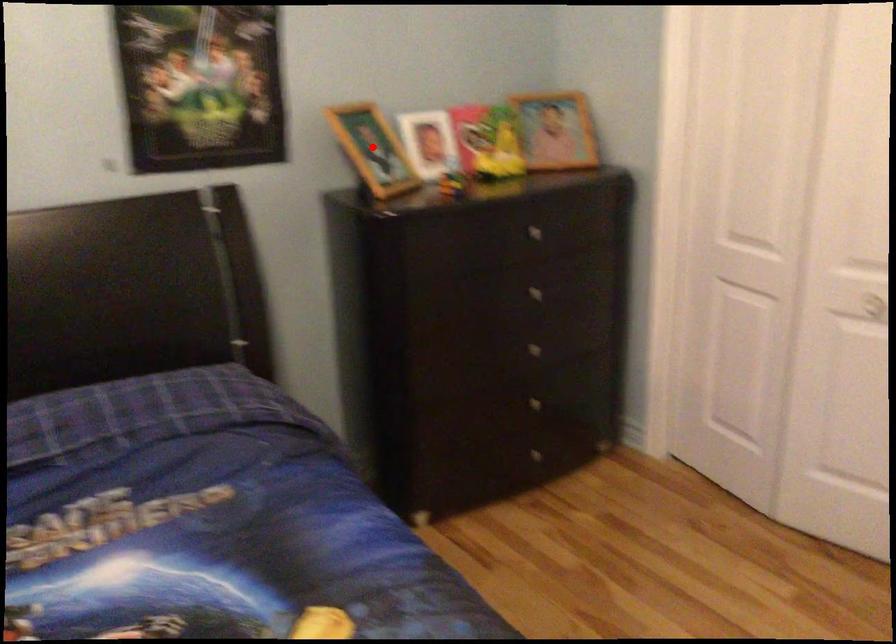
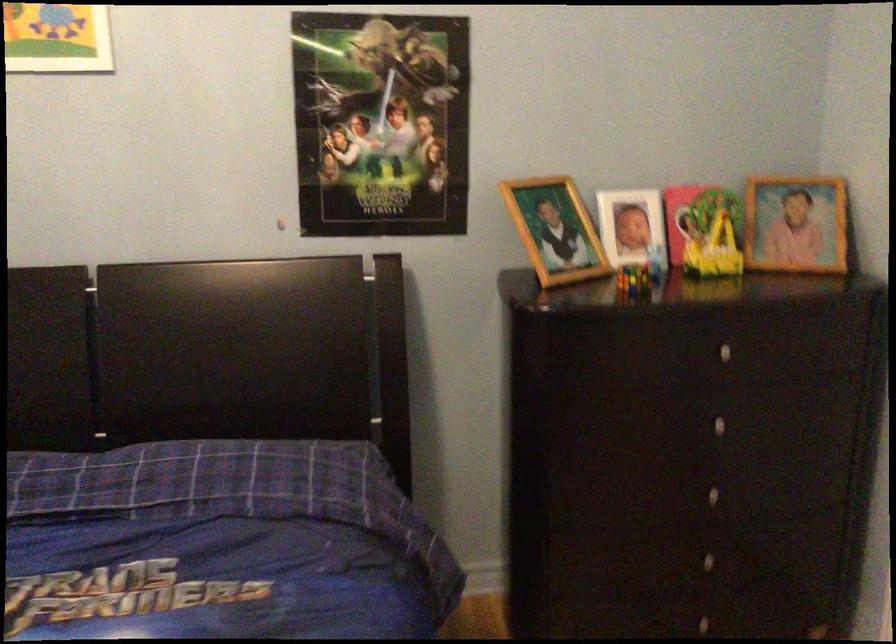
In the second image, find the point that corresponds to the highlighted location in the first image.

(555, 230)